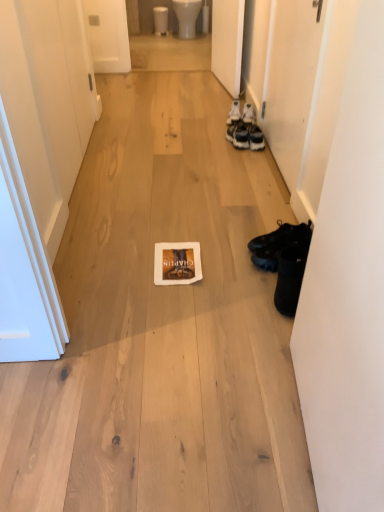
Locate an element on the screen. The height and width of the screenshot is (512, 384). vacant area situated to the left side of white leather sneakers at right, which ranks as the 1th footwear in top-to-bottom order is located at coordinates (204, 114).